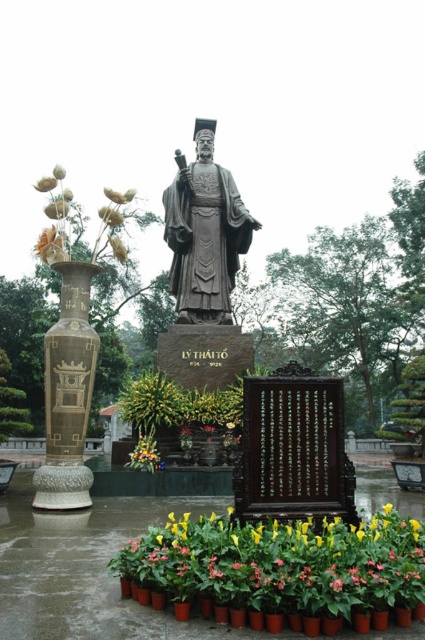
Which of these two, floral arrangement at lower center or stone statue at center, stands shorter?

Standing shorter between the two is floral arrangement at lower center.

Describe the element at coordinates (280, 572) in the screenshot. I see `floral arrangement at lower center` at that location.

Image resolution: width=425 pixels, height=640 pixels. I want to click on floral arrangement at lower center, so click(280, 572).

Who is taller, stone statue at center or yellow matte flower at center?

stone statue at center is taller.

Can you confirm if stone statue at center is smaller than yellow matte flower at center?

Actually, stone statue at center might be larger than yellow matte flower at center.

Between point (206, 132) and point (150, 451), which one is positioned in front?

Point (150, 451) is more forward.

Where is `stone statue at center`? The height and width of the screenshot is (640, 425). stone statue at center is located at coordinates (204, 232).

Can you confirm if floral arrangement at lower center is wider than yellow matte flower at center?

Yes, floral arrangement at lower center is wider than yellow matte flower at center.

What do you see at coordinates (280, 572) in the screenshot?
I see `floral arrangement at lower center` at bounding box center [280, 572].

This screenshot has width=425, height=640. I want to click on floral arrangement at lower center, so click(x=280, y=572).